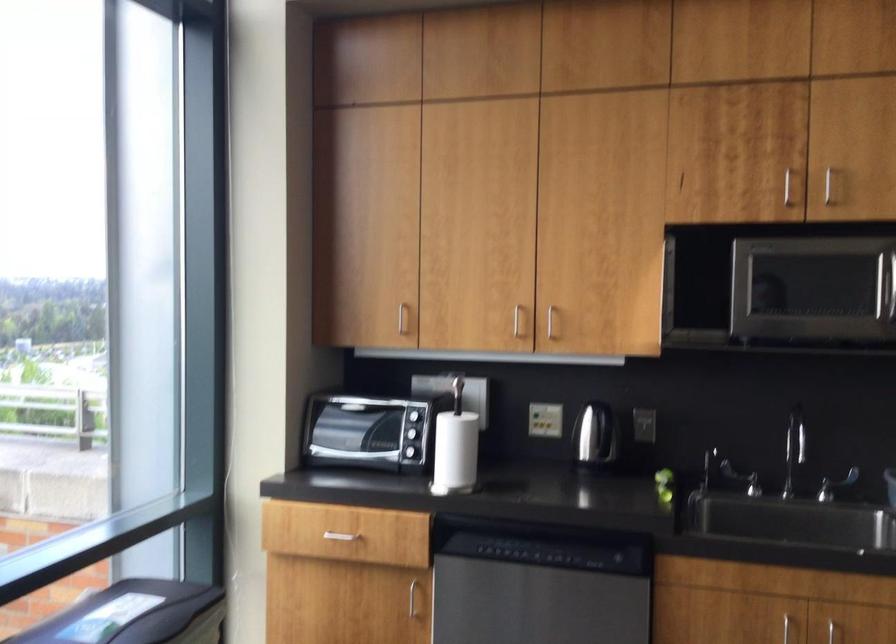
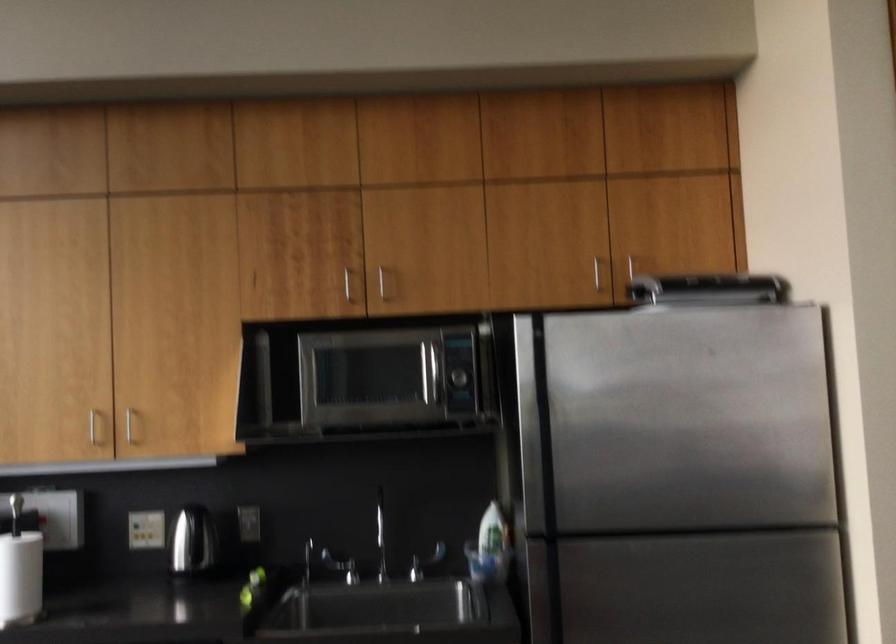
Question: The first image is from the beginning of the video and the second image is from the end. How did the camera likely rotate when shooting the video?

Choices:
 (A) Left
 (B) Right
 (C) Up
 (D) Down

Answer: (B)